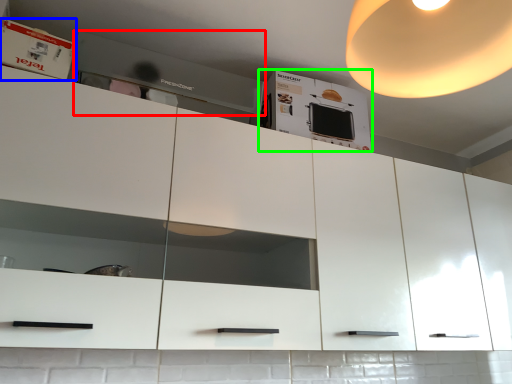
Question: Considering the real-world distances, which object is farthest from home appliance (highlighted by a red box)? cabinet (highlighted by a blue box) or cabinetry (highlighted by a green box)?

Choices:
 (A) cabinet
 (B) cabinetry

Answer: (A)